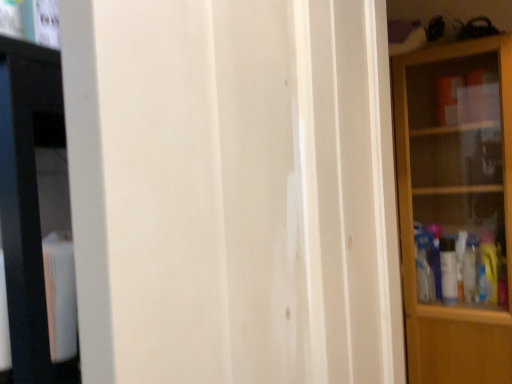
Where is `transparent glass cabinet at right`? The image size is (512, 384). transparent glass cabinet at right is located at coordinates (456, 205).

What do you see at coordinates (456, 205) in the screenshot? This screenshot has height=384, width=512. I see `transparent glass cabinet at right` at bounding box center [456, 205].

Measure the distance between transparent glass cabinet at right and camera.

transparent glass cabinet at right and camera are 4.75 feet apart from each other.

Identify the location of white wood screen door at center. (231, 191).

What is the approximate width of white wood screen door at center?

white wood screen door at center is 5.39 centimeters in width.

Measure the distance between point (x=362, y=130) and camera.

They are 28.98 inches apart.

The height and width of the screenshot is (384, 512). Describe the element at coordinates (231, 191) in the screenshot. I see `white wood screen door at center` at that location.

This screenshot has height=384, width=512. I want to click on transparent glass cabinet at right, so click(x=456, y=205).

Between transparent glass cabinet at right and white wood screen door at center, which one appears on the right side from the viewer's perspective?

Positioned to the right is transparent glass cabinet at right.

Who is more distant, transparent glass cabinet at right or white wood screen door at center?

transparent glass cabinet at right is behind.

Does point (404, 100) come closer to viewer compared to point (162, 70)?

No, (404, 100) is further to viewer.

From the image's perspective, is transparent glass cabinet at right over white wood screen door at center?

No, from the image's perspective, transparent glass cabinet at right is not above white wood screen door at center.

From a real-world perspective, which object stands above the other?

In real-world perspective, white wood screen door at center is above.

Which of these two, transparent glass cabinet at right or white wood screen door at center, is wider?

With larger width is transparent glass cabinet at right.

Considering the relative sizes of transparent glass cabinet at right and white wood screen door at center in the image provided, is transparent glass cabinet at right shorter than white wood screen door at center?

Incorrect, the height of transparent glass cabinet at right does not fall short of that of white wood screen door at center.

Considering the sizes of transparent glass cabinet at right and white wood screen door at center in the image, is transparent glass cabinet at right bigger or smaller than white wood screen door at center?

In the image, transparent glass cabinet at right appears to be larger than white wood screen door at center.

Is transparent glass cabinet at right not within white wood screen door at center?

Yes, transparent glass cabinet at right is not within white wood screen door at center.

Is transparent glass cabinet at right with white wood screen door at center?

There is a gap between transparent glass cabinet at right and white wood screen door at center.

Is transparent glass cabinet at right looking in the opposite direction of white wood screen door at center?

No.

How many degrees apart are the facing directions of transparent glass cabinet at right and white wood screen door at center?

There is a 83.3-degree angle between the facing directions of transparent glass cabinet at right and white wood screen door at center.

Measure the distance between transparent glass cabinet at right and white wood screen door at center.

transparent glass cabinet at right and white wood screen door at center are 3.58 feet apart.

Identify the location of shelf behind the white wood screen door at center. The image size is (512, 384). (456, 205).

Which object is positioned more to the left, white wood screen door at center or transparent glass cabinet at right?

white wood screen door at center.

In the scene shown: Who is more distant, white wood screen door at center or transparent glass cabinet at right?

transparent glass cabinet at right is further from the camera.

Is point (198, 247) positioned after point (481, 100)?

No.

From the image's perspective, relative to transparent glass cabinet at right, is white wood screen door at center above or below?

Based on their image positions, white wood screen door at center is located above transparent glass cabinet at right.

From a real-world perspective, is white wood screen door at center on transparent glass cabinet at right?

Indeed, from a real-world perspective, white wood screen door at center stands above transparent glass cabinet at right.

Is white wood screen door at center thinner than transparent glass cabinet at right?

Correct, the width of white wood screen door at center is less than that of transparent glass cabinet at right.

Who is shorter, white wood screen door at center or transparent glass cabinet at right?

Standing shorter between the two is white wood screen door at center.

Can you confirm if white wood screen door at center is bigger than transparent glass cabinet at right?

No.

Is white wood screen door at center inside or outside of transparent glass cabinet at right?

white wood screen door at center cannot be found inside transparent glass cabinet at right.

Is white wood screen door at center far from transparent glass cabinet at right?

That's right, there is a large distance between white wood screen door at center and transparent glass cabinet at right.

Is white wood screen door at center positioned with its back to transparent glass cabinet at right?

That's not correct — white wood screen door at center is not looking away from transparent glass cabinet at right.

How many degrees apart are the facing directions of white wood screen door at center and transparent glass cabinet at right?

There is a 83.3-degree angle between the facing directions of white wood screen door at center and transparent glass cabinet at right.

Image resolution: width=512 pixels, height=384 pixels. What are the coordinates of `screen door above the transparent glass cabinet at right (from the image's perspective)` in the screenshot? It's located at (231, 191).

You are a GUI agent. You are given a task and a screenshot of the screen. Output one action in this format:
    pyautogui.click(x=<x>, y=<y>)
    Task: Click on the screen door in front of the transparent glass cabinet at right
    The image size is (512, 384).
    Given the screenshot: What is the action you would take?
    pyautogui.click(x=231, y=191)

Where is `screen door on the left side of transparent glass cabinet at right`? screen door on the left side of transparent glass cabinet at right is located at coordinates (231, 191).